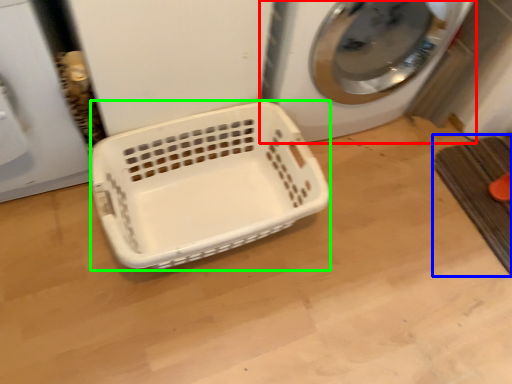
Question: Which object is the farthest from washing machine (highlighted by a red box)? Choose among these: bath mat (highlighted by a blue box) or basket (highlighted by a green box).

Choices:
 (A) bath mat
 (B) basket

Answer: (A)